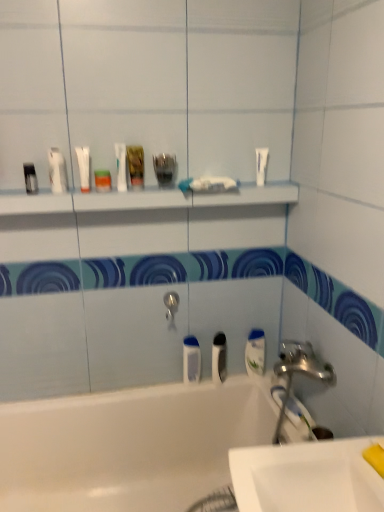
You are a GUI agent. You are given a task and a screenshot of the screen. Output one action in this format:
    pyautogui.click(x=<x>, y=<y>)
    Task: Click on the blank space situated above white glossy sink at lower right (from a real-world perspective)
    This screenshot has width=384, height=512.
    Given the screenshot: What is the action you would take?
    pyautogui.click(x=323, y=459)